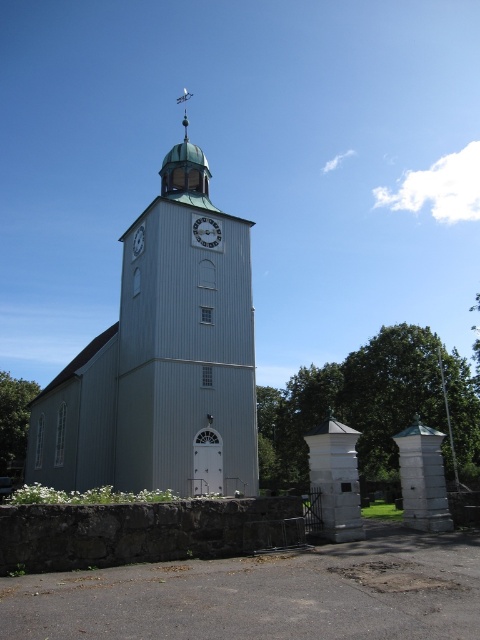
Consider the image. You are standing at the point marked by coordinates point (163,362). Which object in the scene is located exactly at your current position?

The gray wooden church at center is located exactly at point (163,362).